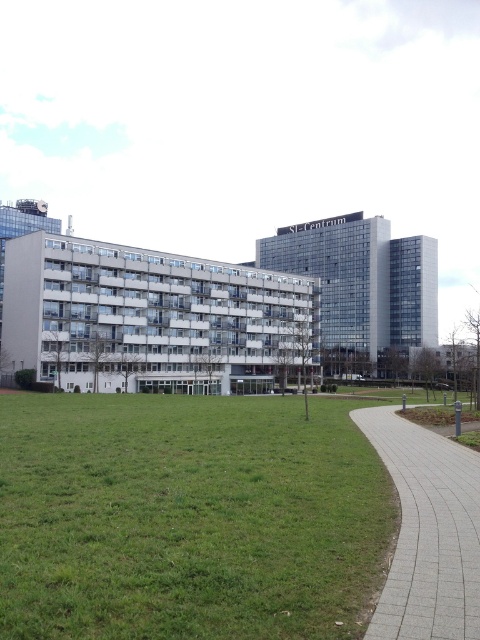
Question: Does gray concrete pavement at lower right come behind glassy steel building at center?

Choices:
 (A) yes
 (B) no

Answer: (B)

Question: Does gray concrete pavement at lower right appear over glassy steel building at center?

Choices:
 (A) yes
 (B) no

Answer: (B)

Question: Considering the relative positions of gray concrete pavement at lower right and glassy steel building at center in the image provided, where is gray concrete pavement at lower right located with respect to glassy steel building at center?

Choices:
 (A) left
 (B) right

Answer: (A)

Question: Which point is closer to the camera taking this photo?

Choices:
 (A) (79, 550)
 (B) (422, 321)
 (C) (422, 596)

Answer: (C)

Question: Which point is farther to the camera?

Choices:
 (A) glassy steel building at center
 (B) gray concrete pavement at lower right

Answer: (A)

Question: Which is nearer to the green grass at lower left?

Choices:
 (A) gray concrete pavement at lower right
 (B) white concrete building at center
 (C) glassy steel building at center

Answer: (A)